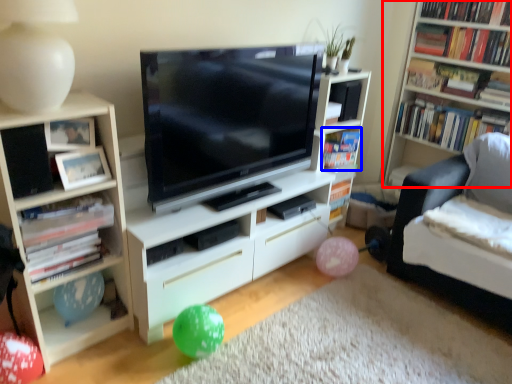
Question: Among these objects, which one is nearest to the camera, shelf (highlighted by a red box) or book (highlighted by a blue box)?

Choices:
 (A) shelf
 (B) book

Answer: (A)